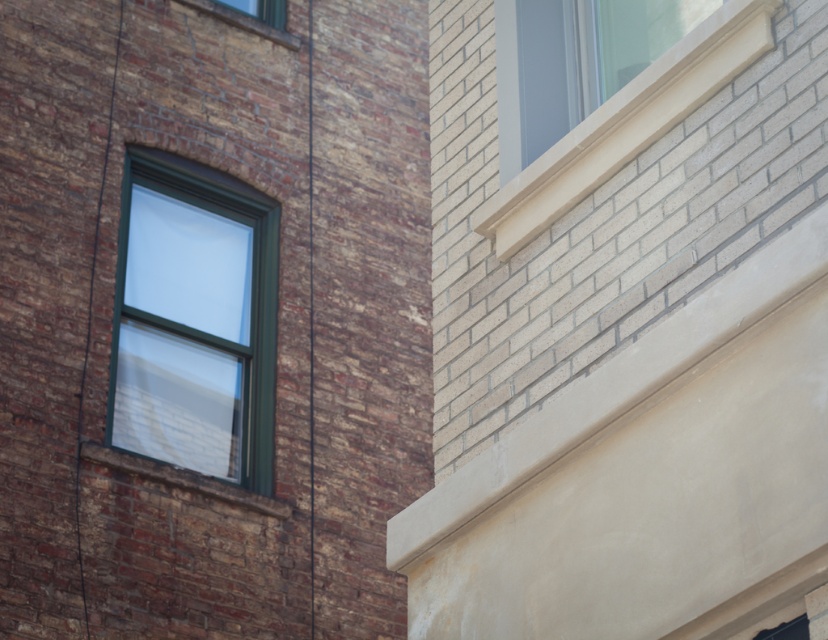
You are standing in front of the two adjacent buildings shown. You notice a point marked at coordinates [195,321]. Which object does this point correspond to?

The point at coordinates [195,321] corresponds to the green glass window at left.

You are an architect reviewing the building layout. You need to determine the spatial relationship between the white smooth window at upper right and the clear glass window at upper center. Which window is positioned to the right of the other?

The white smooth window at upper right is positioned to the right of the clear glass window at upper center.

Based on the photo, you are standing in front of the two adjacent buildings shown in the image. You notice a point marked at coordinates (x=195, y=321). Which object does this point correspond to?

The point at coordinates (x=195, y=321) marks the green glass window at left.